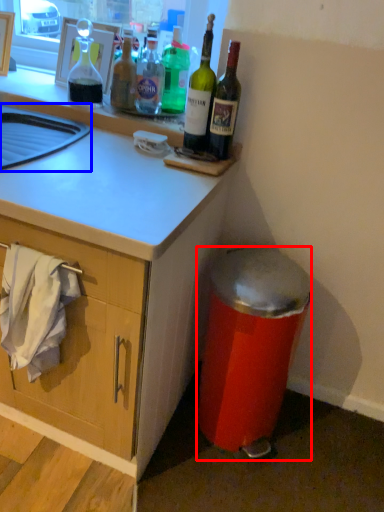
Question: Which point is further to the camera, trash bin/can (highlighted by a red box) or sink (highlighted by a blue box)?

Choices:
 (A) trash bin/can
 (B) sink

Answer: (A)